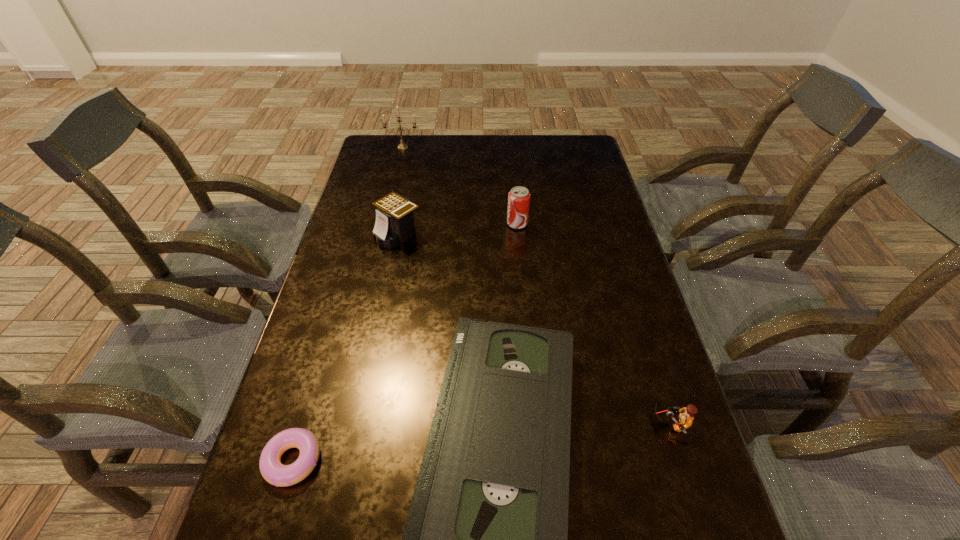
Find the location of a particular element. The image size is (960, 540). the tallest object is located at coordinates (402, 146).

Image resolution: width=960 pixels, height=540 pixels. Find the location of `the farthest object`. the farthest object is located at coordinates (402, 146).

Locate an element on the screen. soda can is located at coordinates coord(519,197).

At what (x,y) coordinates should I click in order to perform the action: click on the third tallest object. Please return your answer as a coordinate pair (x, y). The height and width of the screenshot is (540, 960). Looking at the image, I should click on (394, 224).

The height and width of the screenshot is (540, 960). Find the location of `the rightmost object`. the rightmost object is located at coordinates (686, 418).

What are the coordinates of `doughnut` in the screenshot? It's located at (273, 471).

Where is `free space located on the front of the candle`? The height and width of the screenshot is (540, 960). free space located on the front of the candle is located at coordinates (394, 187).

Where is `vacant space situated on the left of the second tallest object`? vacant space situated on the left of the second tallest object is located at coordinates (450, 224).

The height and width of the screenshot is (540, 960). Find the location of `vacant point located 0.070m on the back of the fourth shortest object`. vacant point located 0.070m on the back of the fourth shortest object is located at coordinates (404, 206).

This screenshot has width=960, height=540. I want to click on free space located holding a crossbow in the hands of the Lego, so click(514, 423).